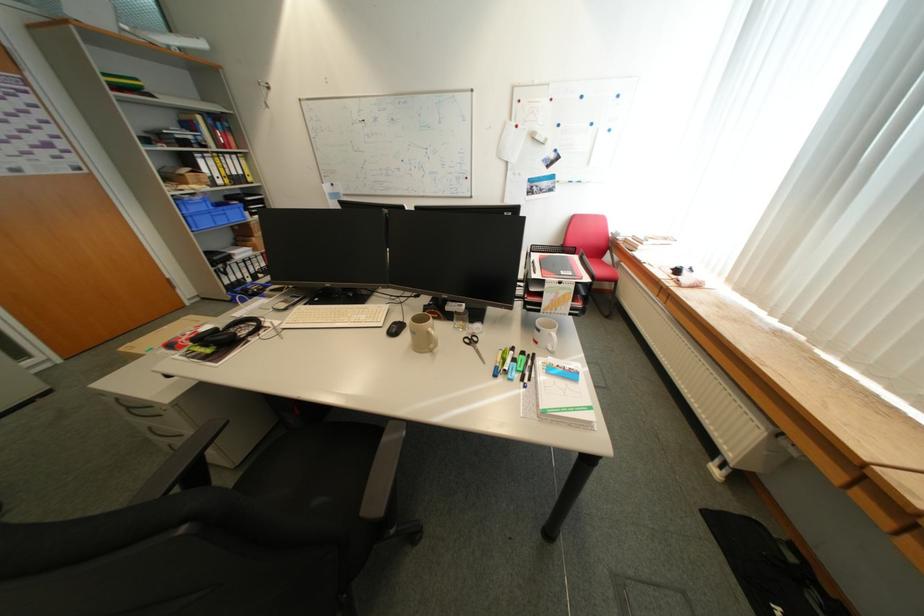
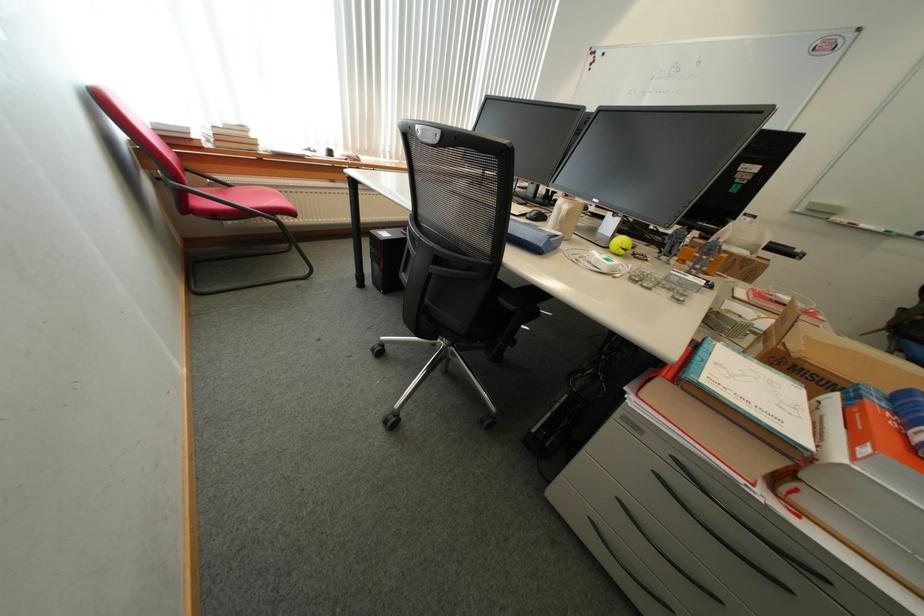
Question: I am providing you with two images of the same scene from different viewpoints. After the viewpoint changes to image2, which objects are now occluded?

Choices:
 (A) chair sitting surface
 (B) cardboard box
 (C) red chair sitting surface
 (D) orange Ryan plush

Answer: (A)